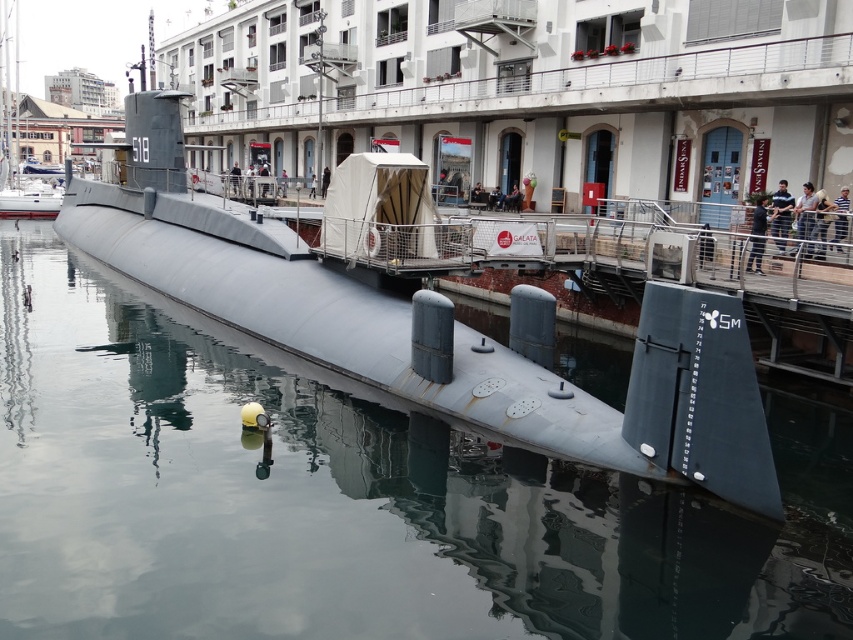
Looking at this image, between glossy metallic submarine at center and matte gray submarine at center, which one is positioned higher?

matte gray submarine at center is above.

Is glossy metallic submarine at center behind matte gray submarine at center?

No, it is not.

Who is more distant from viewer, (515,500) or (509,337)?

The point (509,337) is behind.

Image resolution: width=853 pixels, height=640 pixels. I want to click on glossy metallic submarine at center, so click(352, 499).